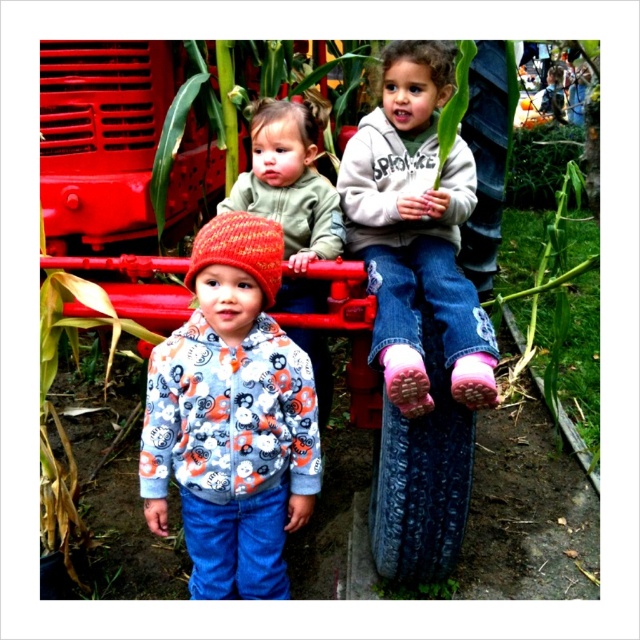
Question: Is knitted woolen hat at center wider than knitted wool hat at center?

Choices:
 (A) yes
 (B) no

Answer: (A)

Question: Which object is positioned closest to the knitted wool hat at center?

Choices:
 (A) knitted woolen hat at center
 (B) pink fuzzy socks at center

Answer: (B)

Question: Does pink fuzzy socks at center have a greater width compared to knitted wool hat at center?

Choices:
 (A) no
 (B) yes

Answer: (B)

Question: Which of the following is the farthest from the observer?

Choices:
 (A) (292, 237)
 (B) (250, 268)
 (C) (436, 93)

Answer: (A)

Question: Is pink fuzzy socks at center positioned before knitted wool hat at center?

Choices:
 (A) yes
 (B) no

Answer: (A)

Question: Which point appears closest to the camera in this image?

Choices:
 (A) (248, 580)
 (B) (332, 234)

Answer: (A)